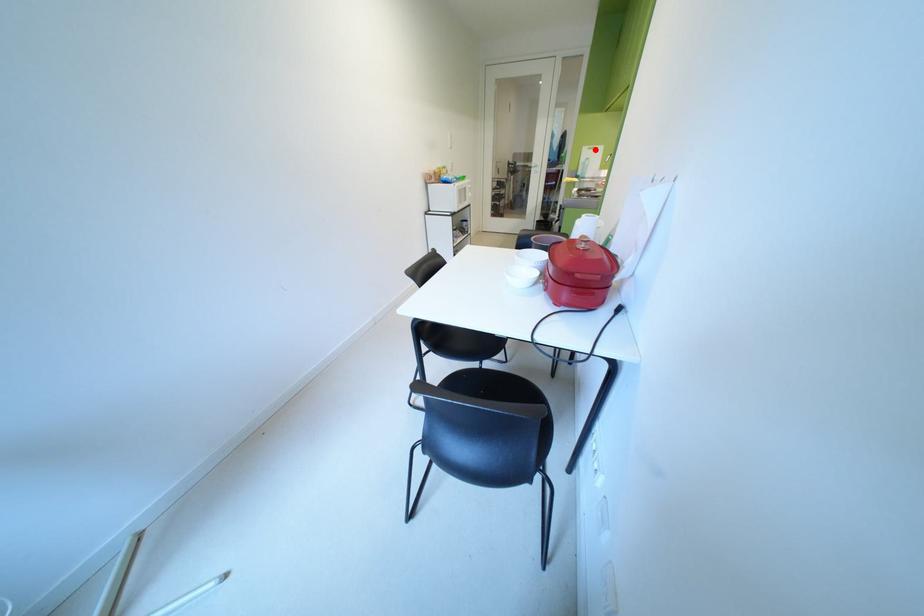
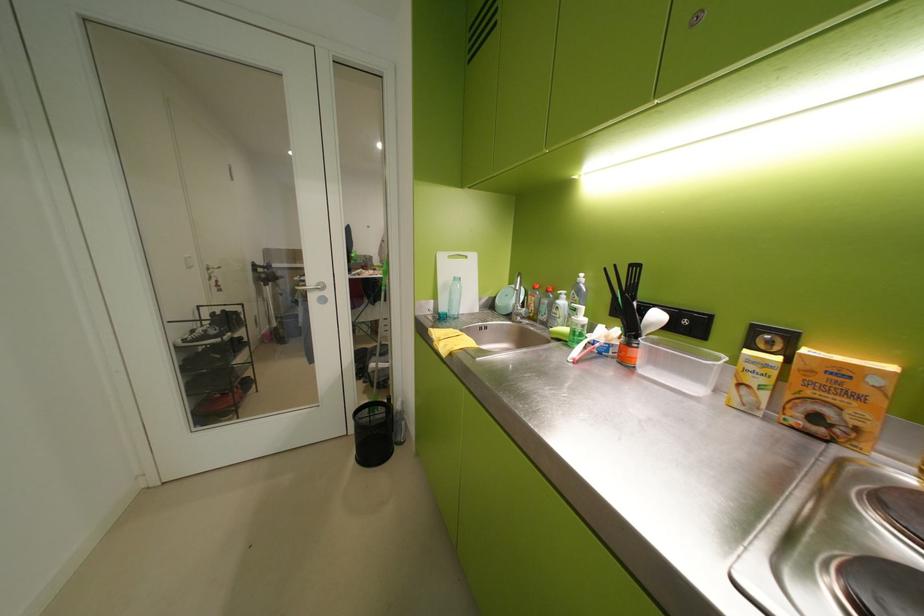
Question: I am providing you with two images of the same scene from different viewpoints. Image1 has a red point marked. In image2, the corresponding 3D location appears at what relative position? Reply with the corresponding letter.

Choices:
 (A) Closer
 (B) Farther

Answer: (B)